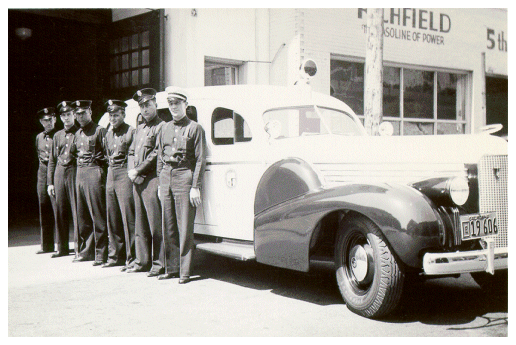
Find the location of a particular element. Image resolution: width=516 pixels, height=345 pixels. windows is located at coordinates (352, 85), (390, 85), (412, 91), (448, 90).